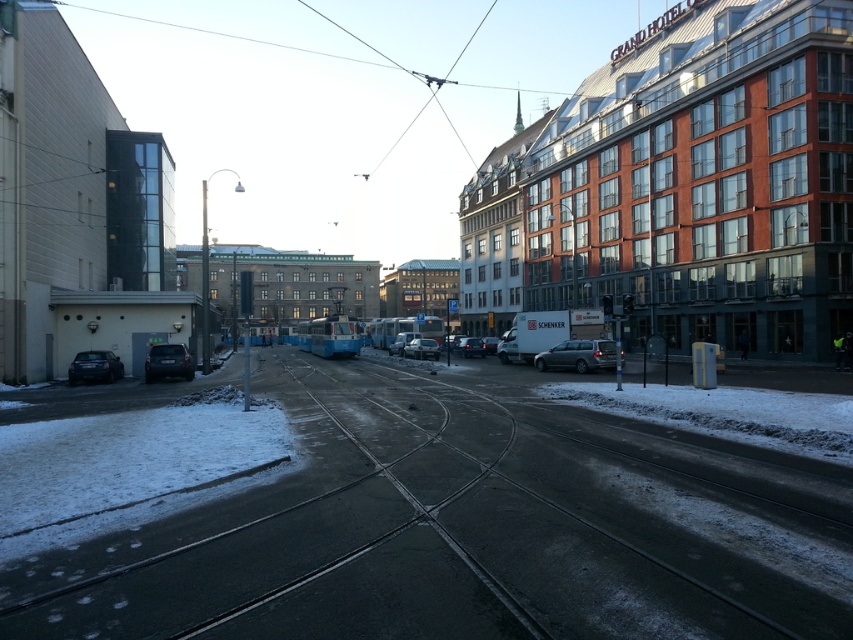
You are a delivery driver who needs to park your delivery van between the silver metallic car at center and the satin black car at lower left. Considering their sizes, which car should you position your van closer to to ensure enough space?

The silver metallic car at center is larger in size than the satin black car at lower left, so positioning the van closer to the satin black car at lower left would leave more space for maneuvering.

You are standing at the tram tracks and looking towards the modern building with large windows. There are two points marked on the ground in front of you. The first point is at coordinate (567, 344) and the second is at (430, 356). Which point is closer to you?

Point (567, 344) is closer to you because it is in front of point (430, 356).

You are driving a car and need to park in this urban area. There is a satin black car at lower left and a satin silver sedan at center. Which vehicle is closer to the curb on the left side of the road?

The satin black car at lower left is closer to the curb on the left side of the road because it is positioned to the left of the satin silver sedan at center.